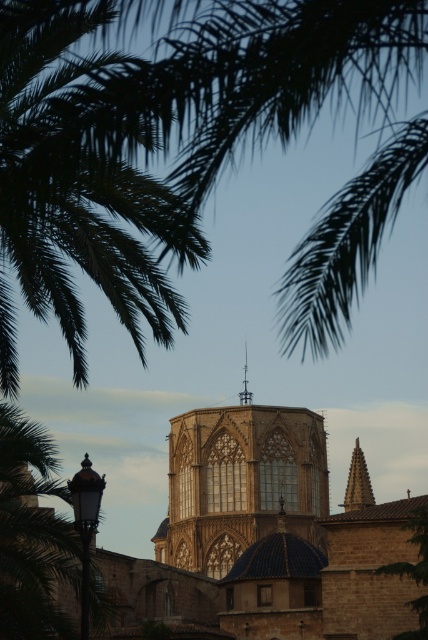
Question: Which object is the farthest from the green leafy palm at upper left?

Choices:
 (A) golden stone spire at center
 (B) shiny silver spire at center

Answer: (B)

Question: Does golden stone tower at center come behind shiny silver spire at center?

Choices:
 (A) no
 (B) yes

Answer: (A)

Question: Which object is positioned closest to the shiny silver spire at center?

Choices:
 (A) green leafy tree at lower right
 (B) golden stone spire at center
 (C) green leafy palm at upper left

Answer: (B)

Question: Does golden stone tower at center have a larger size compared to golden stone spire at center?

Choices:
 (A) yes
 (B) no

Answer: (A)

Question: Is green leafy palm at upper left further to the viewer compared to green leafy tree at lower right?

Choices:
 (A) no
 (B) yes

Answer: (A)

Question: Which object appears farthest from the camera in this image?

Choices:
 (A) shiny silver spire at center
 (B) green leafy tree at lower right
 (C) golden stone tower at center
 (D) golden stone spire at center

Answer: (D)